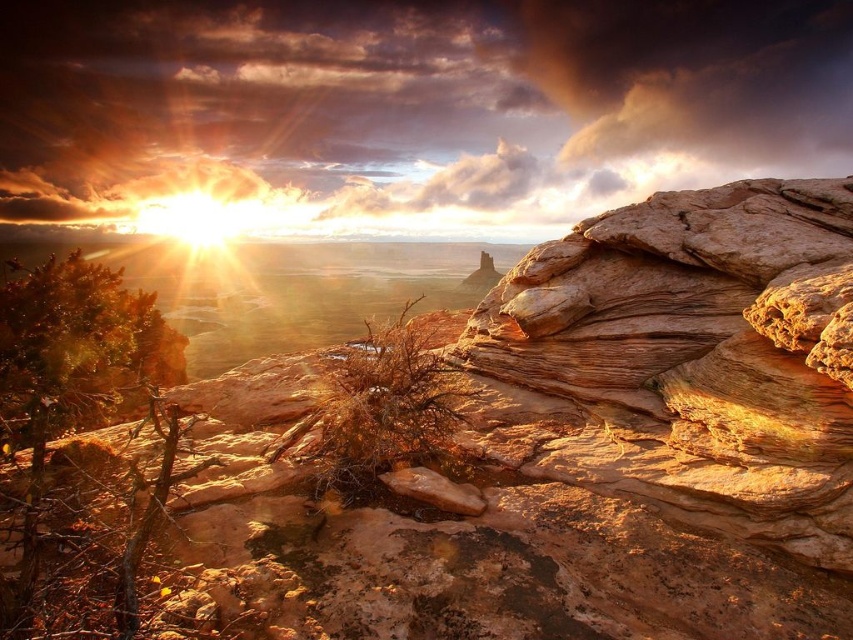
You are a photographer planning to capture the rustic sandstone rock at center and the cloudy textured sky at upper center in a single frame. Based on their positions, can you determine which object is closer to the camera?

The rustic sandstone rock at center is positioned under cloudy textured sky at upper center, so the rustic sandstone rock at center is closer to the camera than the cloudy textured sky at upper center.

Based on the photo, you are standing in the desert and see the rustic sandstone rock at center and the cloudy textured sky at upper center. Which object is positioned to the right of the other?

The cloudy textured sky at upper center is positioned to the right of the rustic sandstone rock at center.